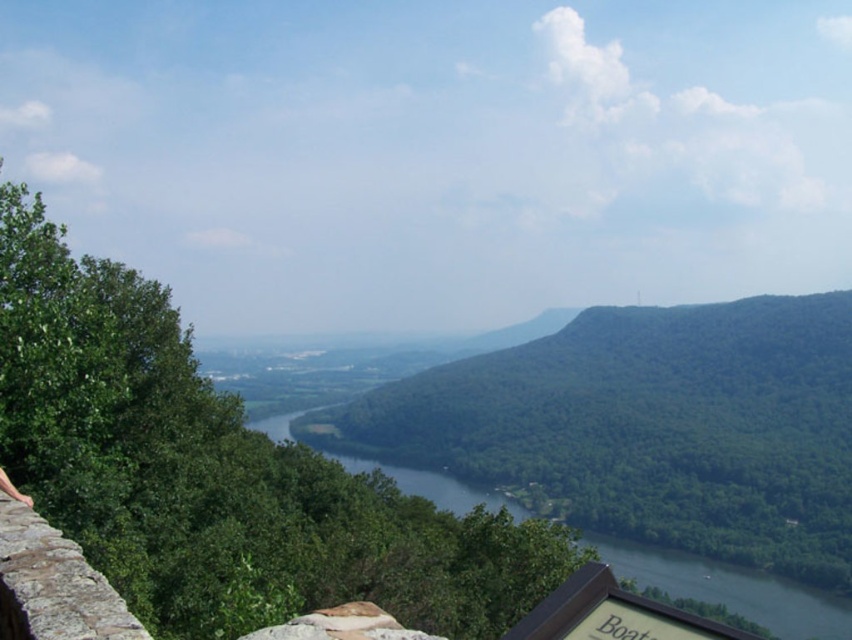
Question: Considering the relative positions of green glossy water at center and wooden signboard at lower right in the image provided, where is green glossy water at center located with respect to wooden signboard at lower right?

Choices:
 (A) above
 (B) below

Answer: (B)

Question: Does green glossy water at center lie behind wooden signboard at lower right?

Choices:
 (A) yes
 (B) no

Answer: (A)

Question: Among these objects, which one is nearest to the camera?

Choices:
 (A) wooden signboard at lower right
 (B) green glossy water at center

Answer: (A)

Question: Can you confirm if green glossy water at center is positioned below wooden signboard at lower right?

Choices:
 (A) yes
 (B) no

Answer: (A)